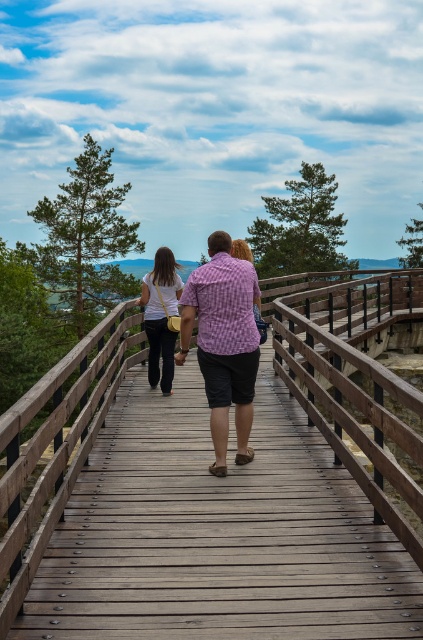
Question: Which of these objects is positioned farthest from the pink checkered shirt at center?

Choices:
 (A) matte white shirt at center
 (B) wooden bridge at center

Answer: (B)

Question: Which of these objects is positioned farthest from the wooden bridge at center?

Choices:
 (A) pink checkered shirt at center
 (B) matte white shirt at center

Answer: (B)

Question: Is wooden bridge at center wider than pink checkered shirt at center?

Choices:
 (A) yes
 (B) no

Answer: (A)

Question: Observing the image, what is the correct spatial positioning of pink checkered shirt at center in reference to matte white shirt at center?

Choices:
 (A) below
 (B) above

Answer: (A)

Question: Which of these objects is positioned closest to the pink checkered shirt at center?

Choices:
 (A) matte white shirt at center
 (B) wooden bridge at center

Answer: (A)

Question: Is wooden bridge at center above matte white shirt at center?

Choices:
 (A) yes
 (B) no

Answer: (B)